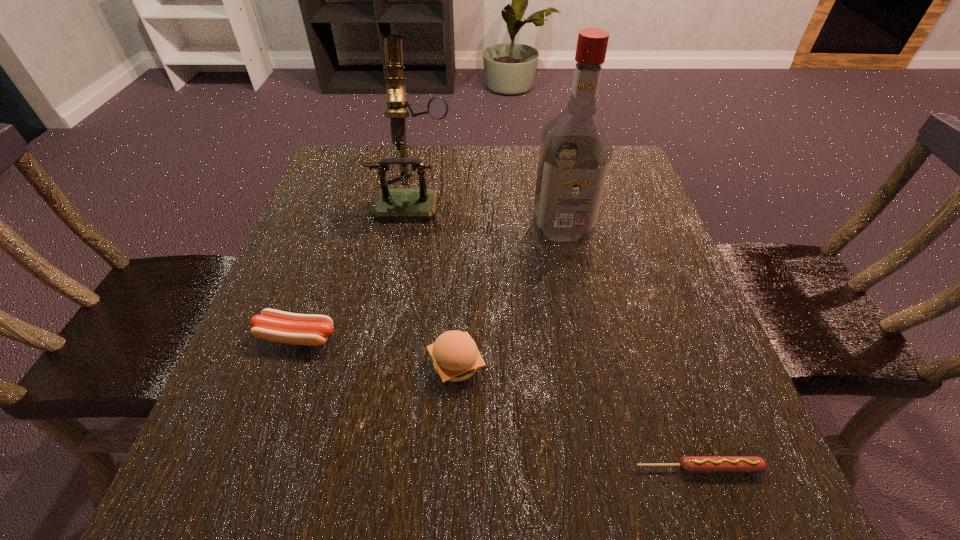
At what (x,y) coordinates should I click in order to perform the action: click on liquor. Please return your answer as a coordinate pair (x, y). Looking at the image, I should click on (575, 152).

This screenshot has height=540, width=960. Identify the location of microscope. (391, 204).

I want to click on hamburger, so click(x=455, y=355).

This screenshot has width=960, height=540. I want to click on the farther sausage, so click(273, 325).

Find the location of `the left sausage`. the left sausage is located at coordinates coord(273,325).

The image size is (960, 540). Identify the location of the nearer sausage. (688, 464).

Where is `the shortest object`? This screenshot has height=540, width=960. the shortest object is located at coordinates (688, 464).

The image size is (960, 540). I want to click on free space located on the front-facing side of the liquor, so 571,279.

Locate an element on the screen. The height and width of the screenshot is (540, 960). vacant space situated at the eyepiece of the fourth shortest object is located at coordinates (386, 364).

At what (x,y) coordinates should I click in order to perform the action: click on free point located on the back of the third shortest object. Please return your answer as a coordinate pair (x, y). This screenshot has width=960, height=540. Looking at the image, I should click on (459, 296).